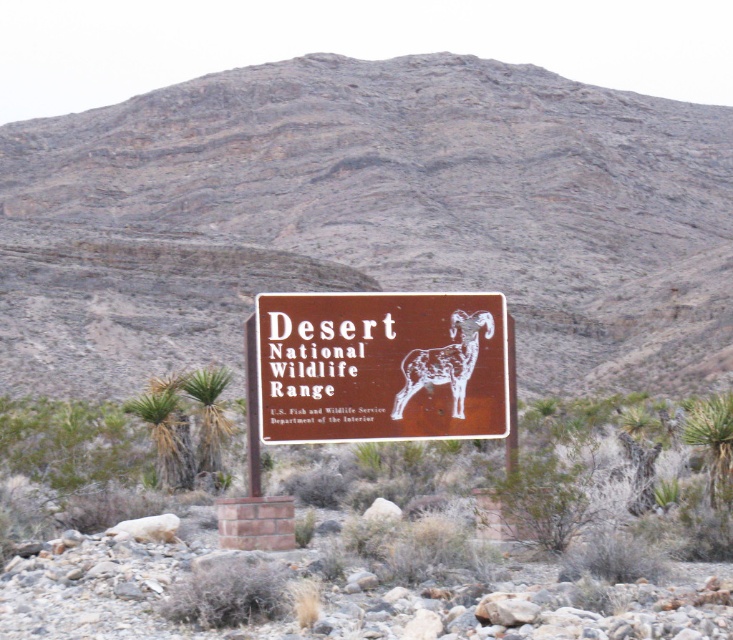
Who is higher up, brown matte sign at center or white textured ram at center?

brown matte sign at center is higher up.

Does brown matte sign at center lie in front of white textured ram at center?

Yes.

The height and width of the screenshot is (640, 733). What do you see at coordinates (380, 365) in the screenshot? I see `brown matte sign at center` at bounding box center [380, 365].

The image size is (733, 640). I want to click on brown matte sign at center, so click(x=380, y=365).